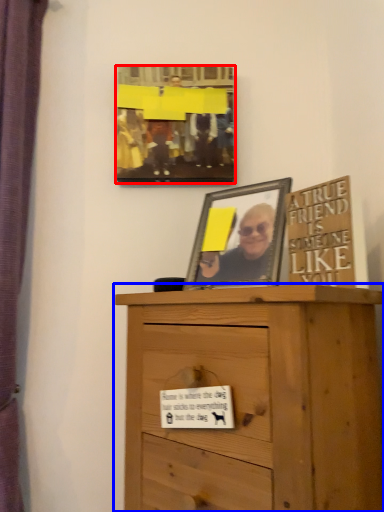
Question: Which point is closer to the camera, picture frame (highlighted by a red box) or chest of drawers (highlighted by a blue box)?

Choices:
 (A) picture frame
 (B) chest of drawers

Answer: (B)